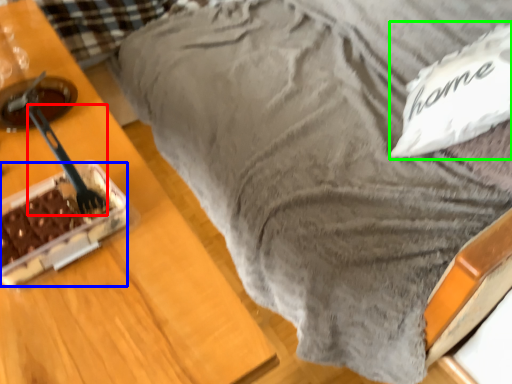
Question: Based on their relative distances, which object is farther from utensil (highlighted by a red box)? Choose from cake (highlighted by a blue box) and pillow (highlighted by a green box).

Choices:
 (A) cake
 (B) pillow

Answer: (B)